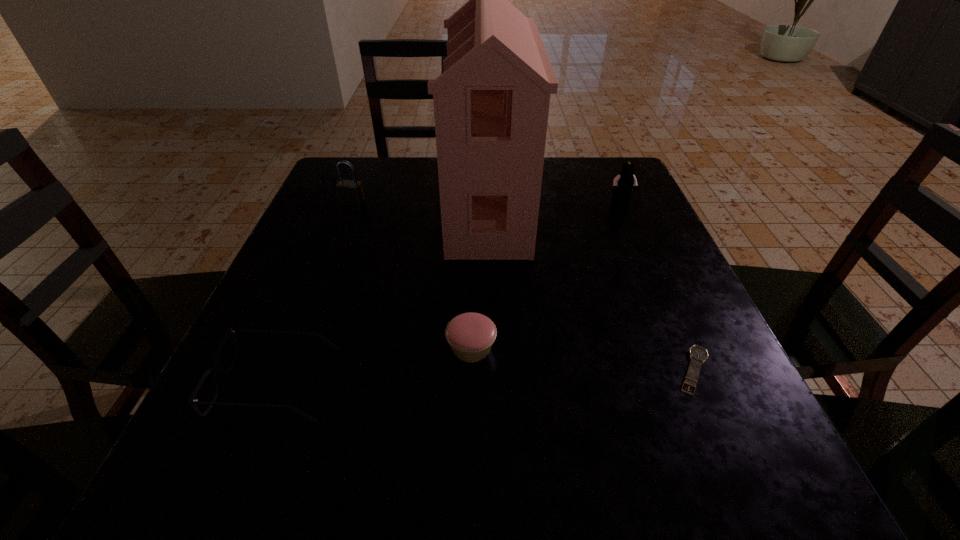
Where is `watch present at the right edge`? The height and width of the screenshot is (540, 960). watch present at the right edge is located at coordinates point(698,355).

Locate an element on the screen. object that is at the far left corner is located at coordinates (350, 192).

The width and height of the screenshot is (960, 540). I want to click on object located at the far right corner, so click(623, 183).

Image resolution: width=960 pixels, height=540 pixels. In the image, there is a desktop. Identify the location of vacant space at the far edge. (572, 202).

At what (x,y) coordinates should I click in order to perform the action: click on free region at the near edge of the desktop. Please return your answer as a coordinate pair (x, y). Looking at the image, I should click on (532, 450).

In the image, there is a desktop. Identify the location of vacant space at the left edge. (360, 233).

The height and width of the screenshot is (540, 960). I want to click on vacant area at the right edge of the desktop, so click(x=602, y=262).

Image resolution: width=960 pixels, height=540 pixels. In the image, there is a desktop. Identify the location of vacant space at the far left corner. (389, 163).

Image resolution: width=960 pixels, height=540 pixels. Find the location of `blank space at the far right corner of the desktop`. blank space at the far right corner of the desktop is located at coordinates (618, 163).

Identify the location of vacant space at the near right corner of the desktop. Image resolution: width=960 pixels, height=540 pixels. (702, 455).